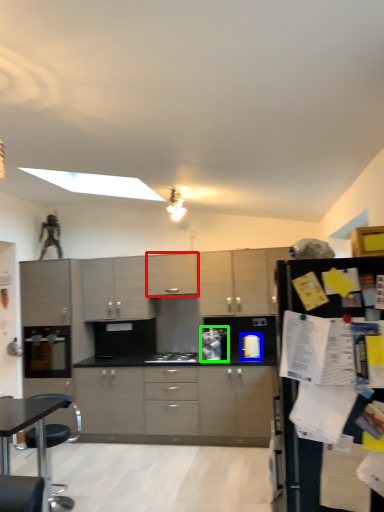
Question: Based on their relative distances, which object is nearer to cabinetry (highlighted by a red box)? Choose from kitchen appliance (highlighted by a blue box) and appliance (highlighted by a green box).

Choices:
 (A) kitchen appliance
 (B) appliance

Answer: (B)